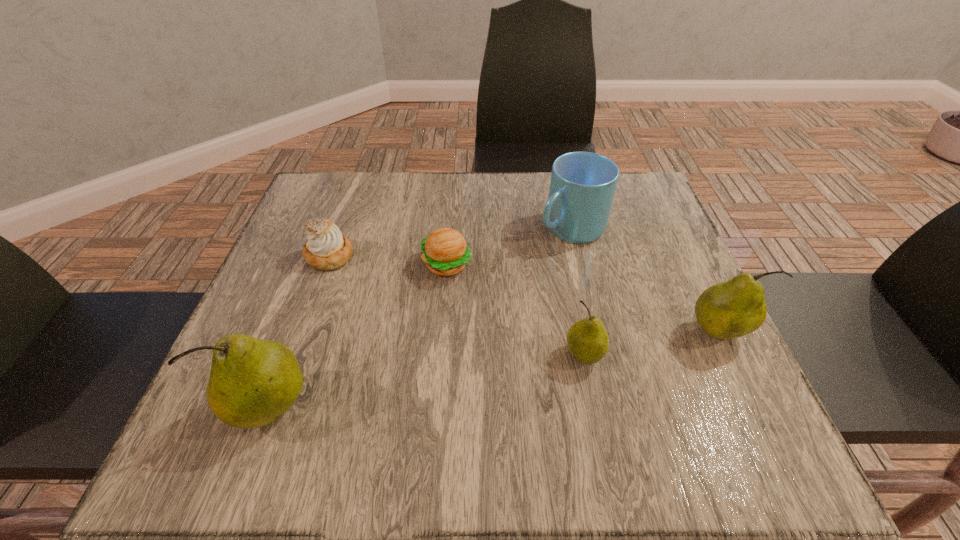
Identify the location of vacant area that lies between the third object from left to right and the mug. The height and width of the screenshot is (540, 960). (509, 246).

Where is `vacant area between the rightmost object and the nearest object`? vacant area between the rightmost object and the nearest object is located at coordinates (496, 370).

Where is `empty location between the second pear from left to right and the third object from left to right`? empty location between the second pear from left to right and the third object from left to right is located at coordinates (516, 310).

In order to click on free spot between the second shortest pear and the nearest pear in this screenshot , I will do `click(496, 370)`.

You are a GUI agent. You are given a task and a screenshot of the screen. Output one action in this format:
    pyautogui.click(x=<x>, y=<y>)
    Task: Click on the free spot between the third object from left to right and the mug
    
    Given the screenshot: What is the action you would take?
    pyautogui.click(x=509, y=246)

At what (x,y) coordinates should I click in order to perform the action: click on free spot between the pastry and the rightmost object. Please return your answer as a coordinate pair (x, y). This screenshot has width=960, height=540. Looking at the image, I should click on (524, 294).

Locate which object ranks second in proximity to the mug. Please provide its 2D coordinates. Your answer should be formatted as a tuple, i.e. [(x, y)], where the tuple contains the x and y coordinates of a point satisfying the conditions above.

[(732, 309)]

Identify which object is located as the third nearest to the hamburger. Please provide its 2D coordinates. Your answer should be formatted as a tuple, i.e. [(x, y)], where the tuple contains the x and y coordinates of a point satisfying the conditions above.

[(587, 339)]

Select which pear appears as the second closest to the second pear from left to right. Please provide its 2D coordinates. Your answer should be formatted as a tuple, i.e. [(x, y)], where the tuple contains the x and y coordinates of a point satisfying the conditions above.

[(252, 382)]

Select which pear is the closest to the shortest pear. Please provide its 2D coordinates. Your answer should be formatted as a tuple, i.e. [(x, y)], where the tuple contains the x and y coordinates of a point satisfying the conditions above.

[(732, 309)]